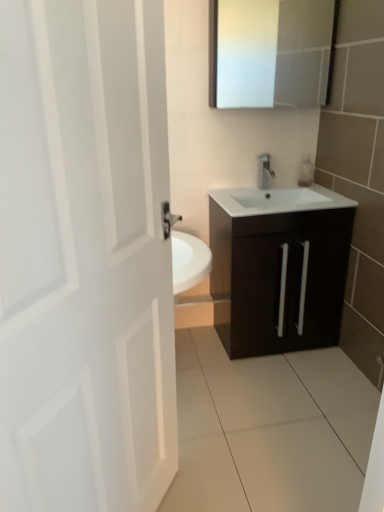
This screenshot has height=512, width=384. I want to click on vacant space to the right of satin nickel faucet at center, so click(x=292, y=190).